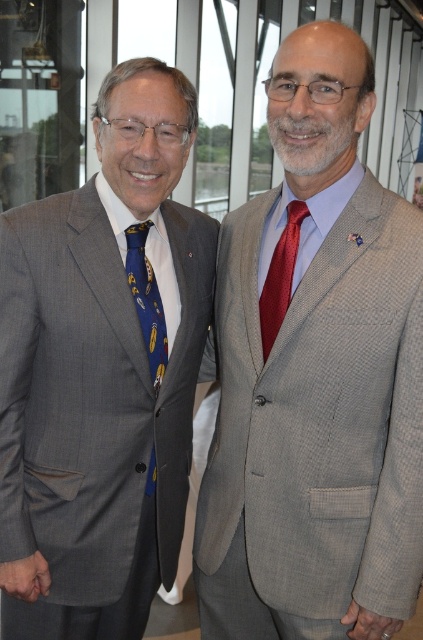
You are an interior designer working on a layout for a room. You need to place a sofa that will occupy the space where the matte gray suit at left is currently located. What are the coordinates of the point where the sofa should be placed?

The coordinates for the point where the matte gray suit at left is located are at point (x=101, y=372). Therefore, the sofa should be placed at coordinates (x=101, y=372).

What is the 2D coordinate of the matte gray suit at center?

The matte gray suit at center is located at the 2D coordinate point of (315, 376).

You are a photographer setting up for a group photo. You need to ensure that both the matte gray suit at left and the blue silk tie at left are clearly visible in the frame. Based on their positions, which one might require you to adjust your camera angle to capture it properly?

The blue silk tie at left is farther from the viewer than the matte gray suit at left, so adjusting the camera angle might be necessary to ensure it is in focus and visible.